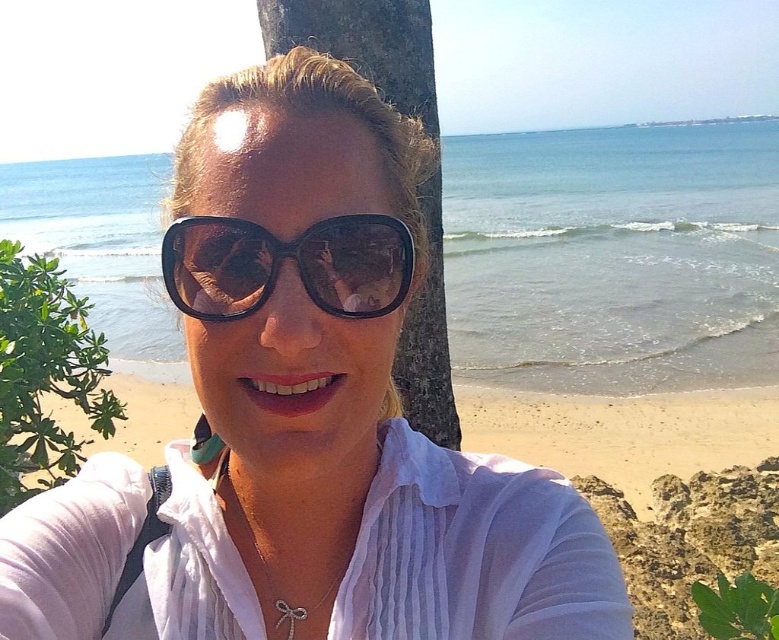
Is white cotton shirt at center smaller than green leafy bush at left?

Yes, white cotton shirt at center is smaller than green leafy bush at left.

Which is below, white cotton shirt at center or green leafy bush at left?

white cotton shirt at center is below.

At what (x,y) coordinates should I click in order to perform the action: click on white cotton shirt at center. Please return your answer as a coordinate pair (x, y). The width and height of the screenshot is (779, 640). Looking at the image, I should click on (474, 552).

Can you confirm if brown textured tree trunk at center is thinner than sunglasses at center?

No, brown textured tree trunk at center is not thinner than sunglasses at center.

Does brown textured tree trunk at center have a smaller size compared to sunglasses at center?

No.

Who is more distant from viewer, (411, 49) or (221, 243)?

The point (411, 49) is more distant.

Find the location of a particular element. The image size is (779, 640). brown textured tree trunk at center is located at coordinates (365, 44).

Does matte black sunglasses at center appear on the left side of white cotton shirt at center?

Correct, you'll find matte black sunglasses at center to the left of white cotton shirt at center.

Is matte black sunglasses at center further to the viewer compared to white cotton shirt at center?

No, it is not.

The image size is (779, 640). Find the location of `matte black sunglasses at center`. matte black sunglasses at center is located at coordinates (302, 419).